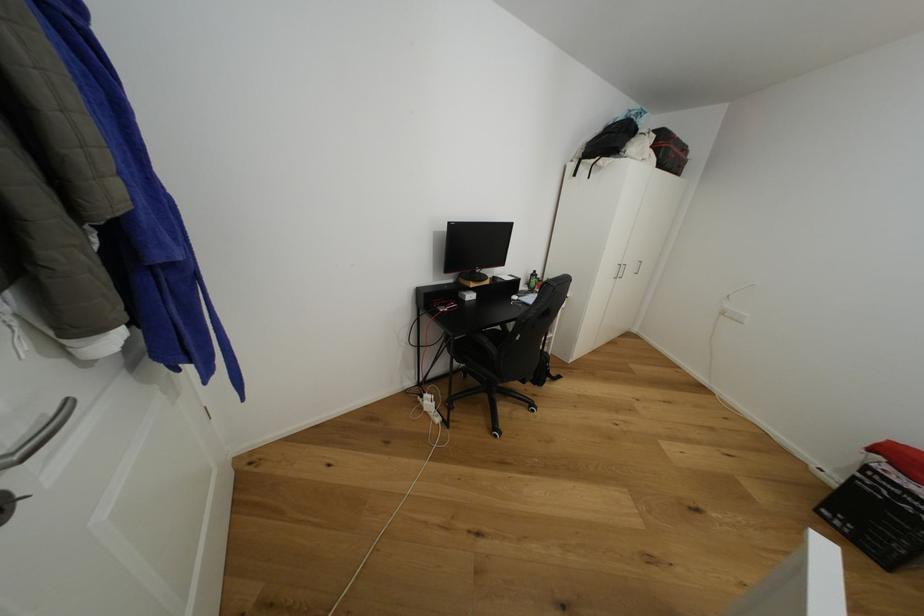
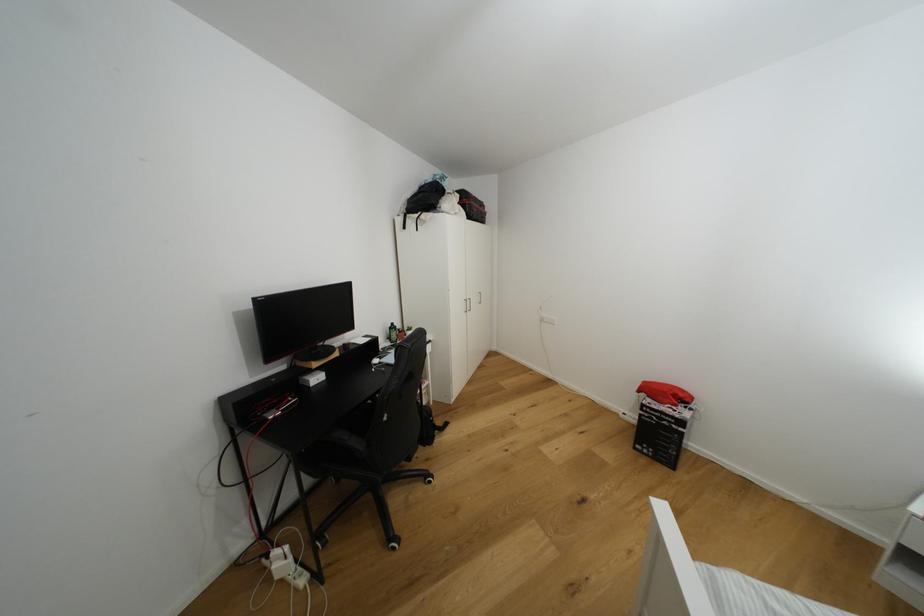
Where in the second image is the point corresponding to the point at 476,298 from the first image?

(322, 379)